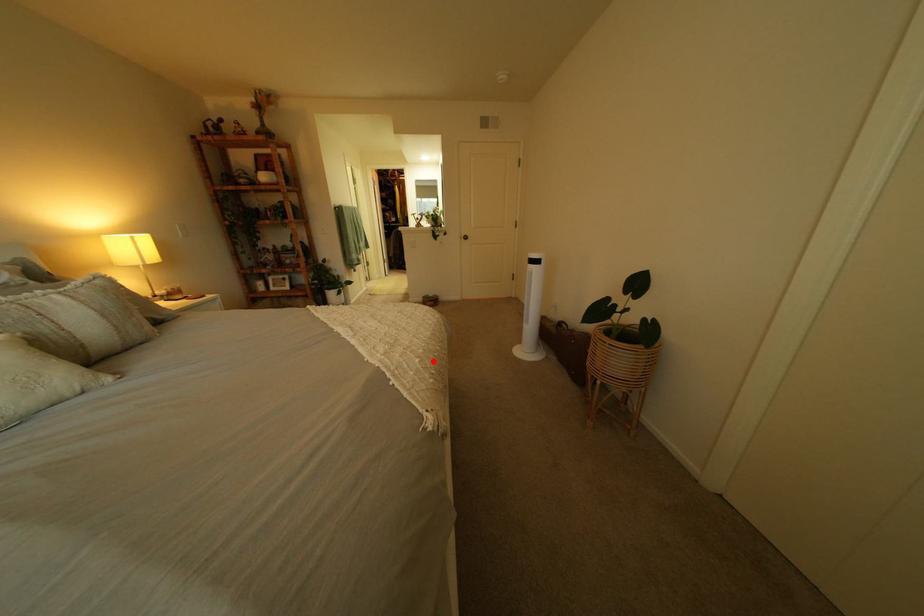
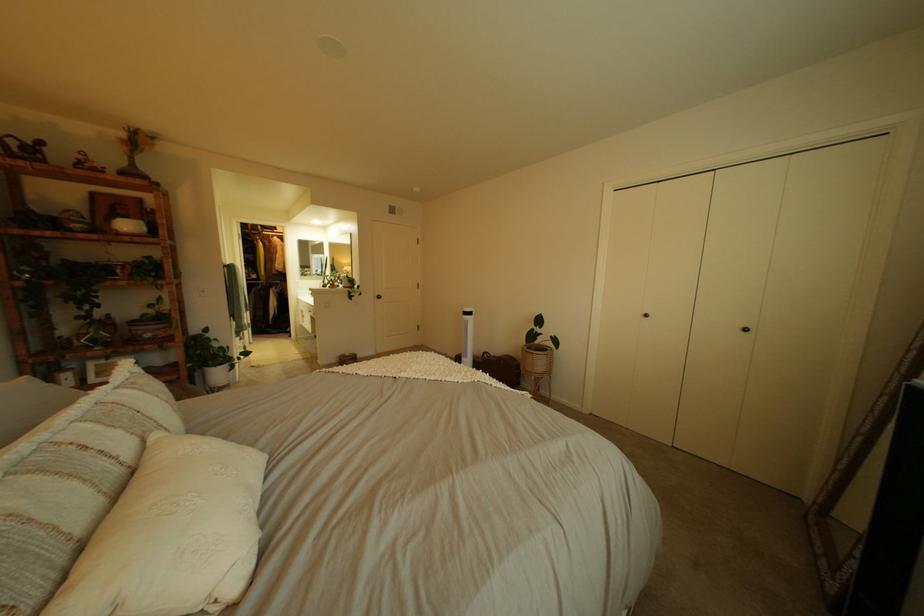
Where in the second image is the point corresponding to the highlighted location from the first image?

(504, 376)